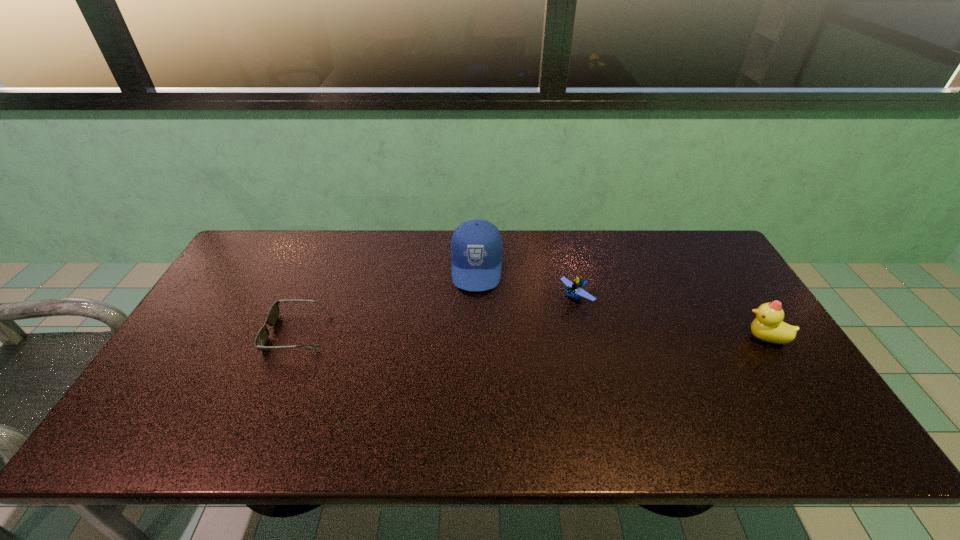
In order to click on the shortest object in this screenshot , I will do `click(261, 339)`.

Image resolution: width=960 pixels, height=540 pixels. Identify the location of the leftmost object. (261, 339).

Where is `the rightmost object`? This screenshot has width=960, height=540. the rightmost object is located at coordinates (768, 325).

Locate an element on the screen. Image resolution: width=960 pixels, height=540 pixels. Lego is located at coordinates (573, 289).

Identify the location of the second shortest object. (573, 289).

The image size is (960, 540). Identify the location of the third object from right to left. (476, 247).

Find the location of a particular element. Image resolution: width=960 pixels, height=540 pixels. vacant space located on the front-facing side of the leftmost object is located at coordinates (247, 332).

You are a GUI agent. You are given a task and a screenshot of the screen. Output one action in this format:
    pyautogui.click(x=<x>, y=<y>)
    Task: Click on the vacant space located on the front-facing side of the leftmost object
    The image size is (960, 540).
    Given the screenshot: What is the action you would take?
    pyautogui.click(x=251, y=332)

Find the location of a particular element. This screenshot has height=540, width=960. vacant space situated on the front-facing side of the leftmost object is located at coordinates (204, 332).

At what (x,y) coordinates should I click in order to perform the action: click on vacant space located on the front-facing side of the duckling. Please return your answer as a coordinate pair (x, y). This screenshot has width=960, height=540. Looking at the image, I should click on 685,338.